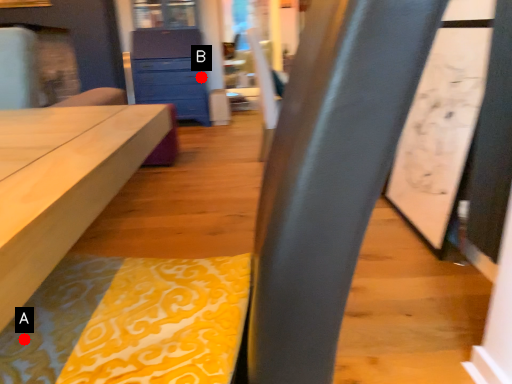
Question: Two points are circled on the image, labeled by A and B beside each circle. Which point appears closest to the camera in this image?

Choices:
 (A) A is closer
 (B) B is closer

Answer: (A)